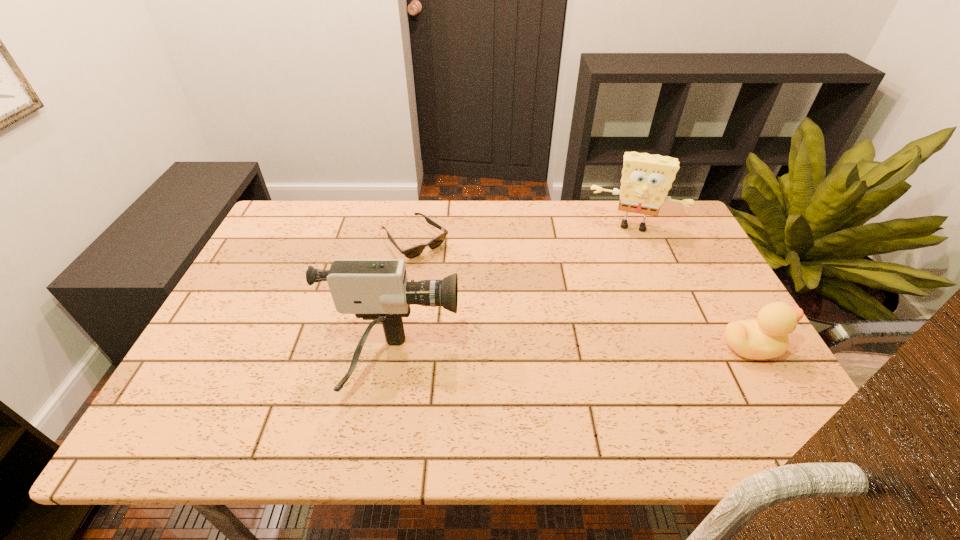
Locate an element on the screen. free space at the right edge of the desktop is located at coordinates click(667, 287).

You are a GUI agent. You are given a task and a screenshot of the screen. Output one action in this format:
    pyautogui.click(x=<x>, y=<y>)
    Task: Click on the vacant space at the far left corner
    Image resolution: width=960 pixels, height=540 pixels.
    Given the screenshot: What is the action you would take?
    pyautogui.click(x=321, y=210)

Where is `empty space that is in between the sunglasses and the duck`? The width and height of the screenshot is (960, 540). empty space that is in between the sunglasses and the duck is located at coordinates (584, 294).

Where is `free area in between the third tallest object and the camcorder`? The image size is (960, 540). free area in between the third tallest object and the camcorder is located at coordinates (572, 355).

Where is `free spot between the camcorder and the sponge`? This screenshot has width=960, height=540. free spot between the camcorder and the sponge is located at coordinates (513, 294).

This screenshot has height=540, width=960. I want to click on vacant area that lies between the sponge and the second shortest object, so click(x=693, y=286).

This screenshot has height=540, width=960. I want to click on free area in between the camcorder and the sponge, so click(x=513, y=294).

Find the location of a particular element. The image size is (960, 540). vacant space that is in between the second shortest object and the shortest object is located at coordinates (584, 294).

Where is `free space between the third tallest object and the camcorder`? Image resolution: width=960 pixels, height=540 pixels. free space between the third tallest object and the camcorder is located at coordinates (572, 355).

This screenshot has height=540, width=960. Find the location of `vacant space that's between the second shortest object and the camcorder`. vacant space that's between the second shortest object and the camcorder is located at coordinates (572, 355).